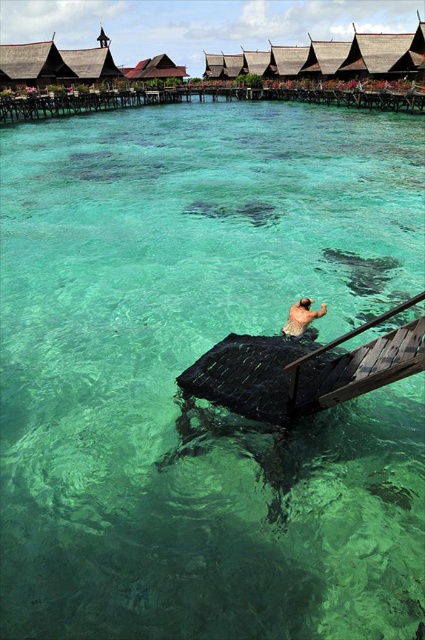
You are navigating a small boat in the tropical setting and need to dock. The wooden dock at upper center is your destination. Based on the coordinates provided in the Objects Description, can you determine if the dock is positioned to the left or right side of the image?

The wooden dock at upper center is located at point 0.158 on the x coordinate, which places it closer to the left side of the image since lower x values indicate positions further left.